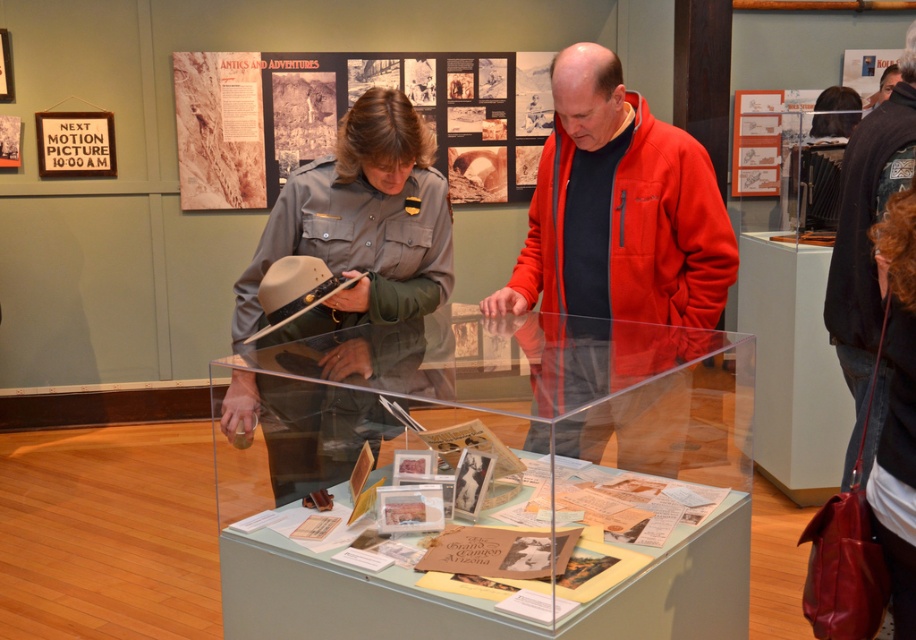
You are a visitor in the museum and want to take a photo of the clear acrylic display case at center and the black woolen jacket at upper right. Which object should you focus on first if you want to capture both in a single frame without moving your camera?

The clear acrylic display case at center is to the left of the black woolen jacket at upper right, so you should focus on the clear acrylic display case at center first to ensure both objects are in frame.

You are a visitor at the museum and want to take a photo of the clear acrylic display case at center and the red fleece jacket at center. Since you want both items to be fully visible in the frame, which object should you focus on to ensure both are captured properly?

The clear acrylic display case at center is wider than the red fleece jacket at center, so you should focus on the clear acrylic display case at center to ensure both items are fully visible in the frame.

You are standing in the museum and want to locate the gray uniform at center. Can you tell me its exact position in terms of coordinates?

The gray uniform at center is located at coordinates point (x=360, y=225).